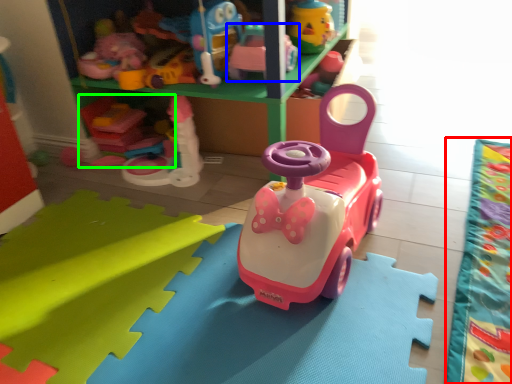
Question: Which is nearer to the blanket (highlighted by a red box)? toy (highlighted by a blue box) or toy (highlighted by a green box).

Choices:
 (A) toy
 (B) toy

Answer: (A)